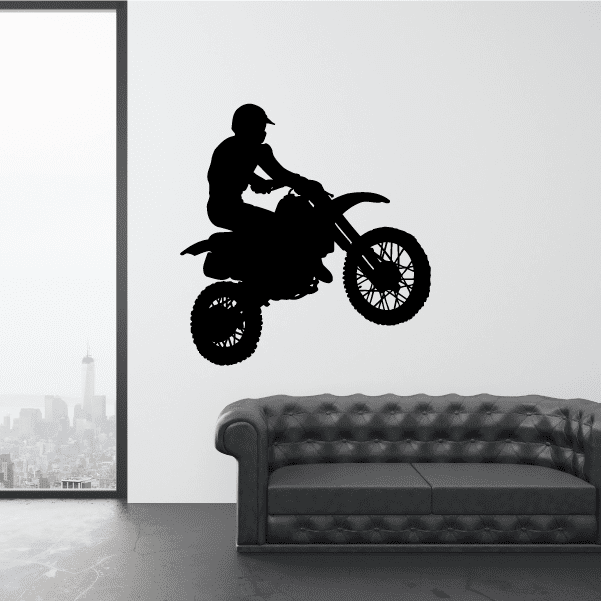
The width and height of the screenshot is (601, 601). I want to click on window, so click(53, 159).